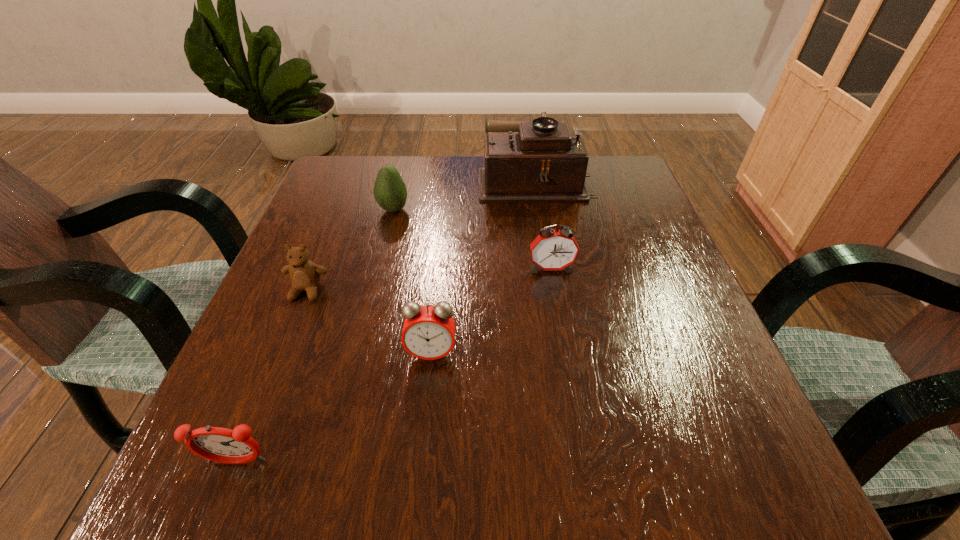
Find the location of a particular element. vacant space at the far right corner of the desktop is located at coordinates (612, 205).

Locate an element on the screen. The height and width of the screenshot is (540, 960). free space at the near right corner of the desktop is located at coordinates (719, 496).

At what (x,y) coordinates should I click in order to perform the action: click on free space that is in between the tallest object and the second nearest alarm clock. Please return your answer as a coordinate pair (x, y). The width and height of the screenshot is (960, 540). Looking at the image, I should click on (483, 266).

Image resolution: width=960 pixels, height=540 pixels. I want to click on free space between the fourth farthest object and the nearest alarm clock, so click(x=272, y=376).

This screenshot has height=540, width=960. What are the coordinates of `empty location between the farthest alarm clock and the nearest object` in the screenshot? It's located at (394, 365).

Locate an element on the screen. free spot between the rightmost alarm clock and the leftmost alarm clock is located at coordinates (394, 365).

You are a GUI agent. You are given a task and a screenshot of the screen. Output one action in this format:
    pyautogui.click(x=<x>, y=<y>)
    Task: Click on the empty space between the fifth farthest object and the nearest object
    The width and height of the screenshot is (960, 540).
    Given the screenshot: What is the action you would take?
    pyautogui.click(x=334, y=408)

Identify the location of empty location between the teddy bear and the phonograph_record. This screenshot has width=960, height=540. (421, 235).

Image resolution: width=960 pixels, height=540 pixels. Find the location of `vacant region between the tallest object and the avocado`. vacant region between the tallest object and the avocado is located at coordinates (464, 194).

Identify the location of vacant area that lies between the avocado and the rightmost alarm clock. This screenshot has width=960, height=540. [x=472, y=239].